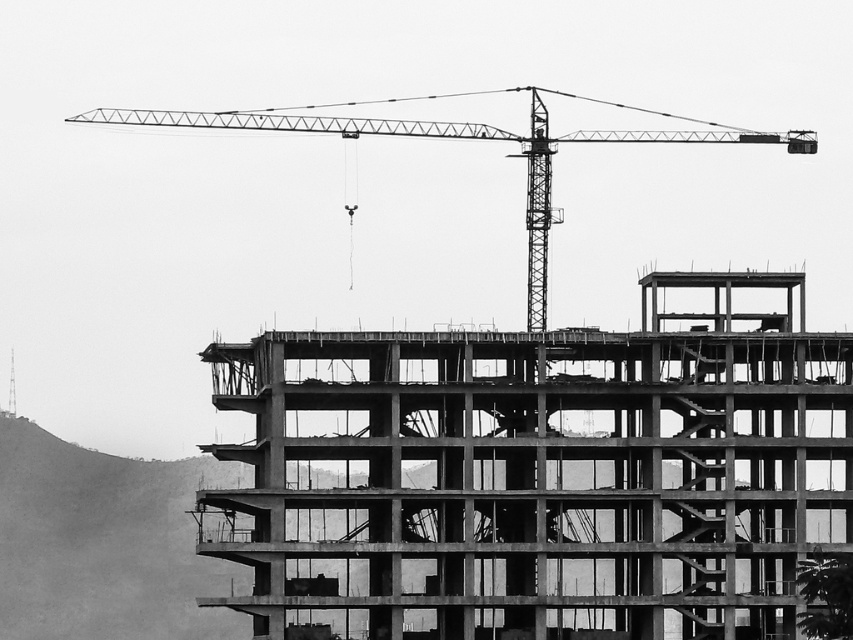
Based on the photo, is concrete at center thinner than metallic construction crane at upper center?

Yes, concrete at center is thinner than metallic construction crane at upper center.

Does concrete at center appear on the left side of metallic construction crane at upper center?

Incorrect, concrete at center is not on the left side of metallic construction crane at upper center.

Between point (300, 342) and point (218, 124), which one is positioned behind?

The point (218, 124) is more distant.

Where is `concrete at center`? The height and width of the screenshot is (640, 853). concrete at center is located at coordinates (540, 472).